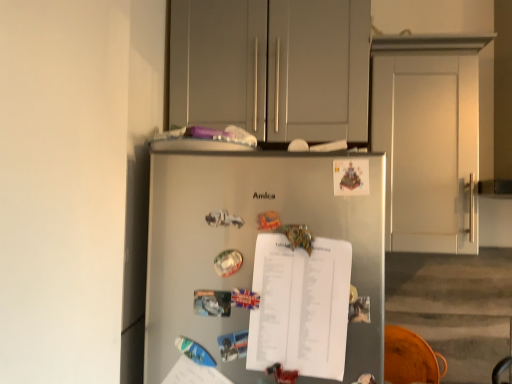
What do you see at coordinates (410, 358) in the screenshot? I see `orange wood swivel chair at lower right` at bounding box center [410, 358].

What is the approximate width of matte gray cabinets at upper center?

13.02 inches.

What are the coordinates of `satin silver refrigerator at center` in the screenshot? It's located at (251, 244).

Locate an element on the screen. The width and height of the screenshot is (512, 384). white matte door at upper right is located at coordinates (428, 149).

Find the location of a particular element. orange wood swivel chair at lower right is located at coordinates (410, 358).

From the picture: Which object is more forward, matte gray cabinets at upper center or white paper at center?

Positioned in front is white paper at center.

From the image's perspective, is matte gray cabinets at upper center above or below white paper at center?

From the image's perspective, matte gray cabinets at upper center appears above white paper at center.

Would you say matte gray cabinets at upper center is outside white paper at center?

Absolutely, matte gray cabinets at upper center is external to white paper at center.

Considering the positions of objects white paper at center and matte gray cabinets at upper center in the image provided, who is in front, white paper at center or matte gray cabinets at upper center?

white paper at center is more forward.

Does point (336, 257) come closer to viewer compared to point (270, 117)?

Yes.

Is white paper at center taller or shorter than matte gray cabinets at upper center?

In the image, white paper at center appears to be shorter than matte gray cabinets at upper center.

In terms of size, does white paper at center appear bigger or smaller than matte gray cabinets at upper center?

Considering their sizes, white paper at center takes up less space than matte gray cabinets at upper center.

Between white matte door at upper right and orange wood swivel chair at lower right, which one has smaller size?

With smaller size is orange wood swivel chair at lower right.

Can we say white matte door at upper right lies outside orange wood swivel chair at lower right?

Yes, white matte door at upper right is not within orange wood swivel chair at lower right.

From the image's perspective, is satin silver refrigerator at center above or below white matte door at upper right?

From the image's perspective, satin silver refrigerator at center appears below white matte door at upper right.

Which is closer, (240, 193) or (471, 240)?

Point (240, 193) appears to be closer to the viewer than point (471, 240).

Choose the correct answer: Is satin silver refrigerator at center inside white matte door at upper right or outside it?

satin silver refrigerator at center is spatially situated outside white matte door at upper right.

Identify the location of door located above the satin silver refrigerator at center (from the image's perspective). (428, 149).

Can you confirm if white paper at center is bigger than white matte door at upper right?

Incorrect, white paper at center is not larger than white matte door at upper right.

Image resolution: width=512 pixels, height=384 pixels. I want to click on door on the right of white paper at center, so click(x=428, y=149).

Are white paper at center and white matte door at upper right located far from each other?

They are positioned close to each other.

Is white paper at center facing towards white matte door at upper right?

No, white paper at center is not turned towards white matte door at upper right.

Is point (411, 378) closer or farther from the camera than point (474, 189)?

Clearly, point (411, 378) is more distant from the camera than point (474, 189).

In the scene shown: Is orange wood swivel chair at lower right positioned with its back to white matte door at upper right?

orange wood swivel chair at lower right does not have its back to white matte door at upper right.

Is orange wood swivel chair at lower right at the right side of white matte door at upper right?

In fact, orange wood swivel chair at lower right is to the left of white matte door at upper right.

Which of these two, white paper at center or orange wood swivel chair at lower right, stands taller?

orange wood swivel chair at lower right.

Is white paper at center situated inside orange wood swivel chair at lower right or outside?

white paper at center is not enclosed by orange wood swivel chair at lower right.

What's the angular difference between white paper at center and orange wood swivel chair at lower right's facing directions?

0.0862 degrees.

Is white paper at center beside orange wood swivel chair at lower right?

white paper at center is not next to orange wood swivel chair at lower right, and they're not touching.

Identify the location of journal that appears below the matte gray cabinets at upper center (from a real-world perspective). (300, 306).

Identify the location of journal below the matte gray cabinets at upper center (from the image's perspective). (300, 306).

When comparing their distances from orange wood swivel chair at lower right, does matte gray cabinets at upper center or white paper at center seem closer?

white paper at center.

Considering their positions, is white matte door at upper right positioned further to orange wood swivel chair at lower right than matte gray cabinets at upper center?

The object further to orange wood swivel chair at lower right is matte gray cabinets at upper center.

Looking at the image, which one is located closer to white matte door at upper right, satin silver refrigerator at center or white paper at center?

Based on the image, satin silver refrigerator at center appears to be nearer to white matte door at upper right.

Considering their positions, is white paper at center positioned further to matte gray cabinets at upper center than satin silver refrigerator at center?

white paper at center is further to matte gray cabinets at upper center.

Looking at this image, when comparing their distances from white matte door at upper right, does matte gray cabinets at upper center or white paper at center seem further?

white paper at center is positioned further to the anchor white matte door at upper right.

Based on their spatial positions, is satin silver refrigerator at center or white matte door at upper right closer to white paper at center?

satin silver refrigerator at center lies closer to white paper at center than the other object.

Considering their positions, is matte gray cabinets at upper center positioned further to orange wood swivel chair at lower right than white matte door at upper right?

matte gray cabinets at upper center lies further to orange wood swivel chair at lower right than the other object.

Looking at the image, which one is located further to matte gray cabinets at upper center, white paper at center or white matte door at upper right?

white paper at center lies further to matte gray cabinets at upper center than the other object.

This screenshot has height=384, width=512. Find the location of `journal that lies between white matte door at upper right and orange wood swivel chair at lower right from top to bottom`. journal that lies between white matte door at upper right and orange wood swivel chair at lower right from top to bottom is located at coordinates (300, 306).

Where is `door between matte gray cabinets at upper center and white paper at center in the vertical direction`? Image resolution: width=512 pixels, height=384 pixels. door between matte gray cabinets at upper center and white paper at center in the vertical direction is located at coordinates (428, 149).

Where is `refrigerator between matte gray cabinets at upper center and white paper at center in the vertical direction`? The height and width of the screenshot is (384, 512). refrigerator between matte gray cabinets at upper center and white paper at center in the vertical direction is located at coordinates (251, 244).

Identify the location of refrigerator between matte gray cabinets at upper center and orange wood swivel chair at lower right from top to bottom. The image size is (512, 384). (251, 244).